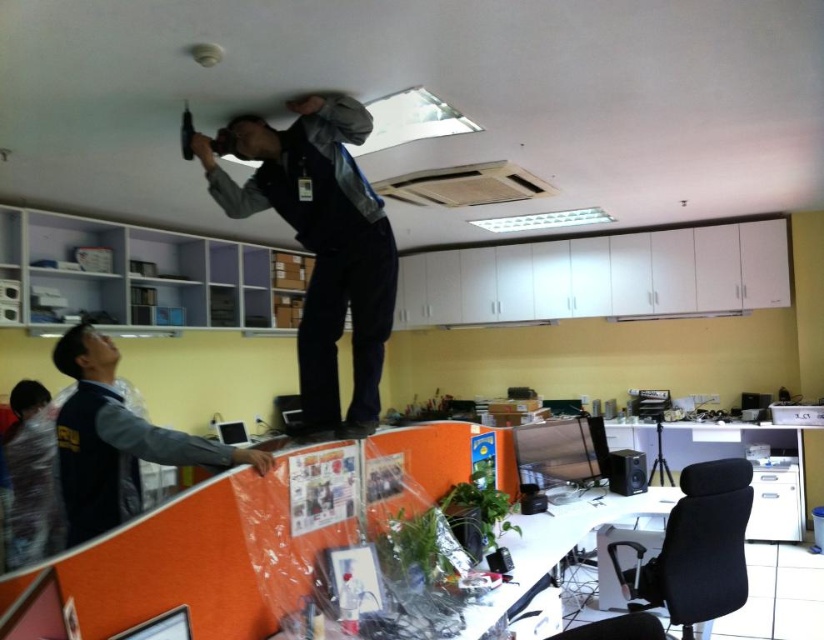
Question: Can you confirm if gray fabric jacket at upper center is positioned below matte black computer at upper center?

Choices:
 (A) no
 (B) yes

Answer: (A)

Question: Among these points, which one is nearest to the camera?

Choices:
 (A) (223, 432)
 (B) (110, 360)

Answer: (B)

Question: Is blue fabric jacket at lower left closer to camera compared to plastic bag at lower left?

Choices:
 (A) yes
 (B) no

Answer: (A)

Question: Is gray fabric jacket at upper center bigger than matte black computer at upper center?

Choices:
 (A) no
 (B) yes

Answer: (B)

Question: Which object is positioned closest to the plastic bag at lower left?

Choices:
 (A) matte black computer at upper center
 (B) blue fabric jacket at lower left

Answer: (B)

Question: Which point appears farthest from the camera in this image?

Choices:
 (A) (36, 401)
 (B) (223, 444)
 (C) (347, 204)
 (D) (204, 445)

Answer: (B)